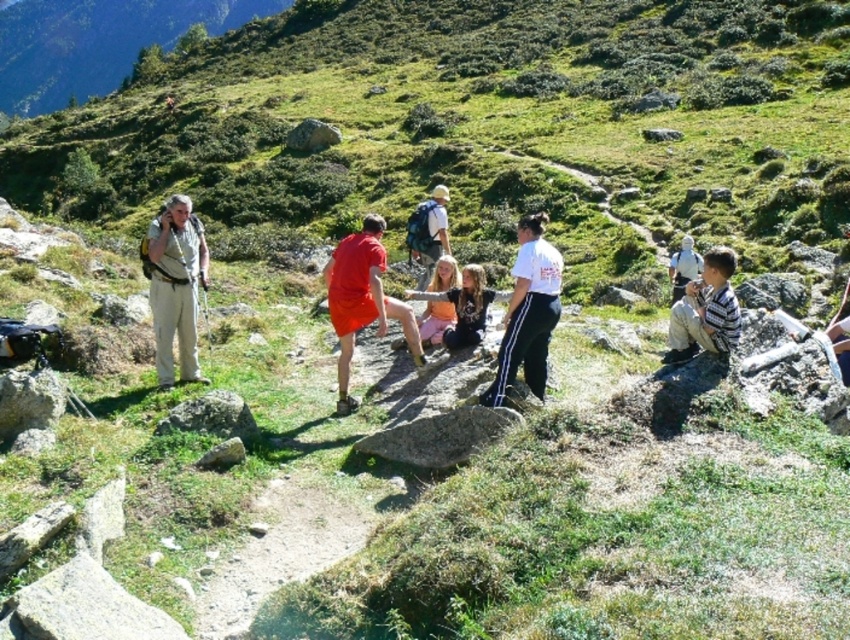
You are a hiker trying to navigate the trail in the image. You need to move from the point at coordinates point (205, 282) to the point at coordinates point (502, 426). Given the mountainous terrain, will moving towards the second point require going uphill or downhill?

Since point (205, 282) is behind point (502, 426), it means that moving from point (205, 282) to point (502, 426) would involve going uphill.

You are a hiker who wants to place your tan fabric backpack at left on top of the gray rough rock at center. Based on the scene description, can the backpack fit on the rock?

The tan fabric backpack at left is bigger than the gray rough rock at center, so the backpack cannot fit on the rock because it is larger than the rock.